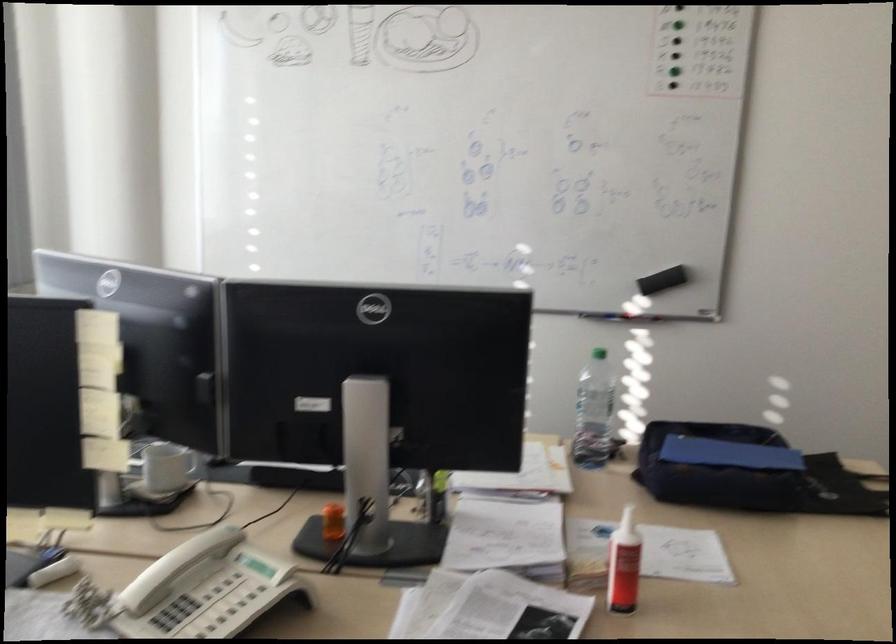
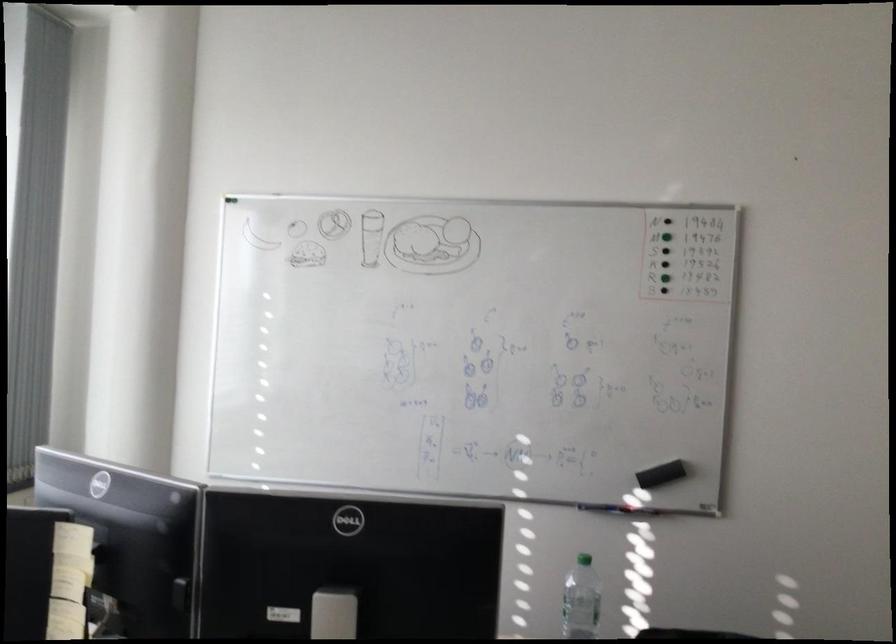
Locate, in the second image, the point that corresponds to (x=595, y=388) in the first image.

(581, 600)